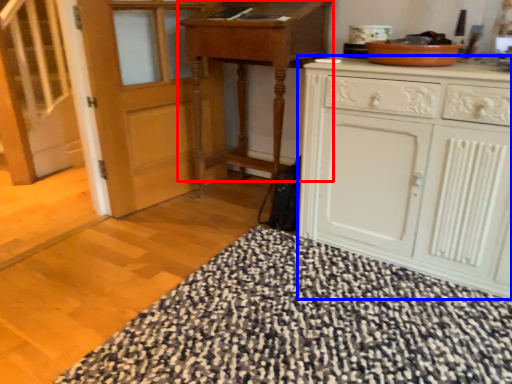
Question: Which point is closer to the camera, table (highlighted by a red box) or cabinetry (highlighted by a blue box)?

Choices:
 (A) table
 (B) cabinetry

Answer: (B)